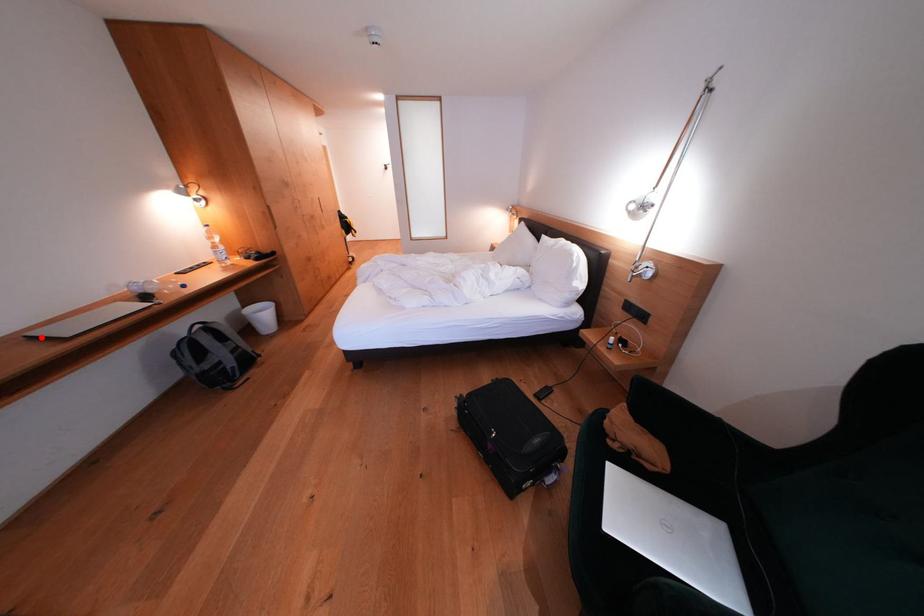
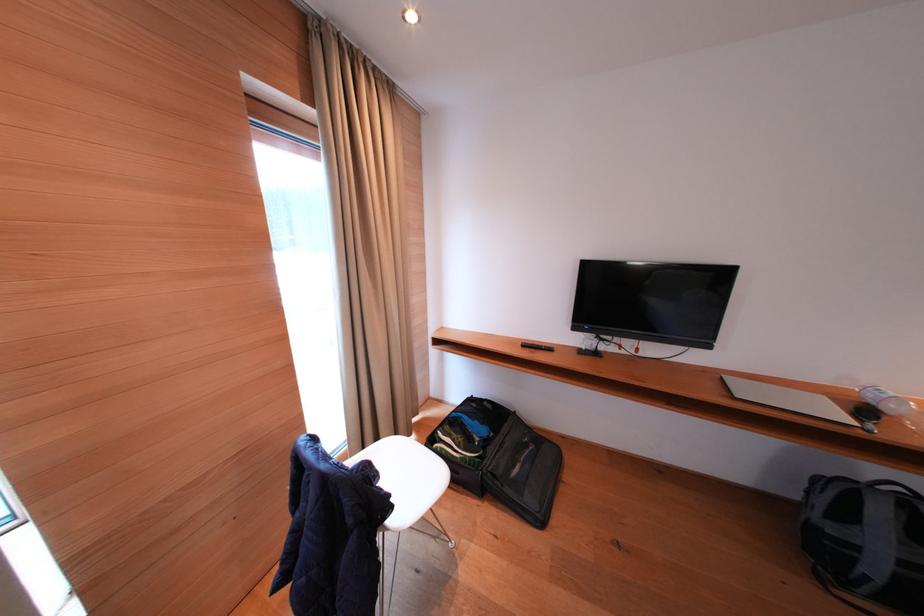
The point at the highlighted location is marked in the first image. Where is the corresponding point in the second image?

(735, 383)